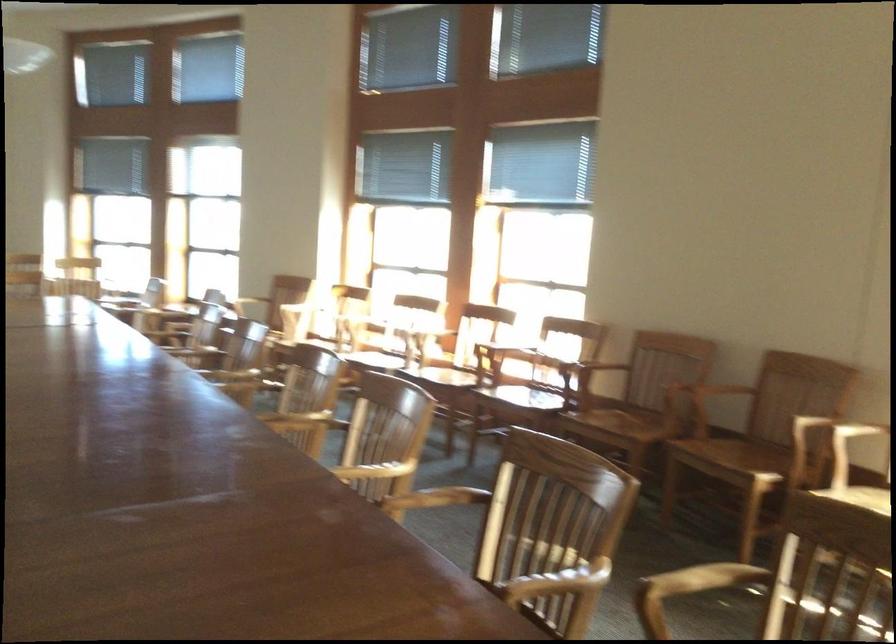
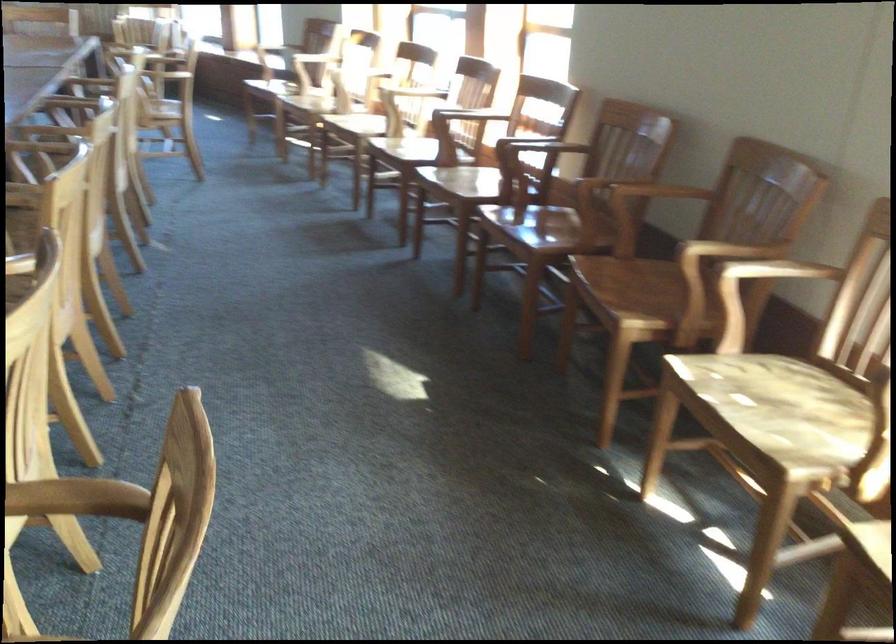
The point at [279,305] is marked in the first image. Where is the corresponding point in the second image?

(312, 58)